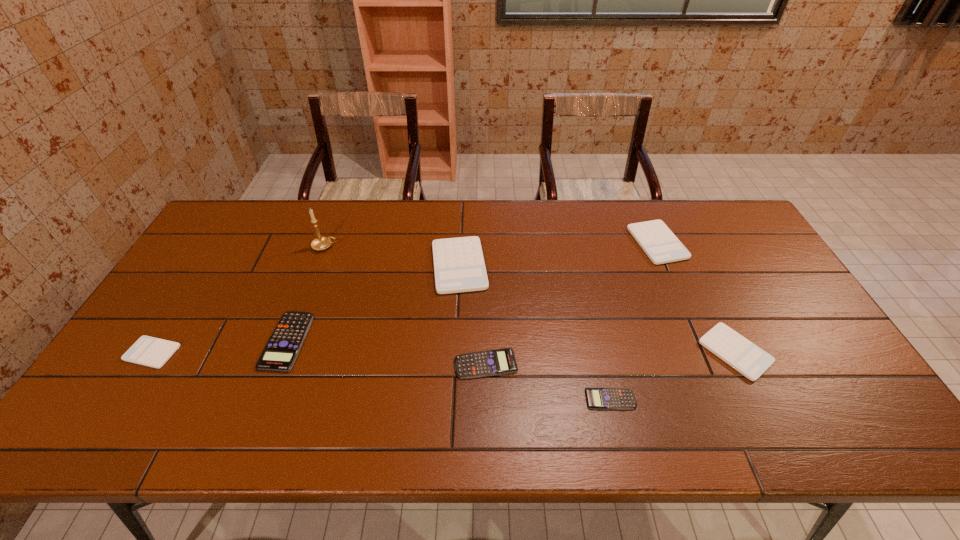
You are a GUI agent. You are given a task and a screenshot of the screen. Output one action in this format:
    pyautogui.click(x=<x>, y=<y>)
    Task: Click on the gold candle holder
    The image size is (960, 540).
    Given the screenshot: What is the action you would take?
    coord(320,243)

The width and height of the screenshot is (960, 540). What are the coordinates of `candle holder` in the screenshot? It's located at (320, 243).

This screenshot has height=540, width=960. Find the location of `the seventh shortest object`. the seventh shortest object is located at coordinates (459, 266).

Find the location of a particular element. This screenshot has height=540, width=960. the second white calculator from left to right is located at coordinates (459, 266).

Where is `the sixth shortest object`? The image size is (960, 540). the sixth shortest object is located at coordinates (659, 243).

Locate an element on the screen. Image resolution: width=960 pixels, height=540 pixels. the sixth shortest calculator is located at coordinates (659, 243).

I want to click on the fifth shortest calculator, so click(x=751, y=361).

The image size is (960, 540). In order to click on the fourth tallest object in this screenshot , I will do `click(751, 361)`.

This screenshot has height=540, width=960. What are the coordinates of `the leftmost calculator` in the screenshot? It's located at (149, 351).

Locate an element on the screen. Image resolution: width=960 pixels, height=540 pixels. the leftmost white calculator is located at coordinates (149, 351).